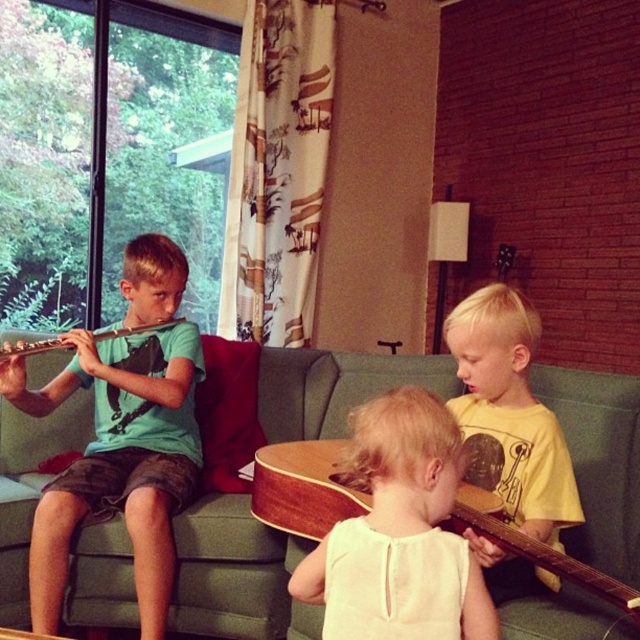
Question: Which is farther from the green matte t-shirt at left?

Choices:
 (A) green fabric couch at center
 (B) light blonde hair at center
 (C) wooden acoustic guitar at center

Answer: (B)

Question: Considering the relative positions of light blonde hair at center and wooden acoustic guitar at center in the image provided, where is light blonde hair at center located with respect to wooden acoustic guitar at center?

Choices:
 (A) above
 (B) below

Answer: (A)

Question: Is light blonde hair at center to the left of wooden acoustic guitar at center from the viewer's perspective?

Choices:
 (A) no
 (B) yes

Answer: (B)

Question: Is green matte t-shirt at left further to the viewer compared to wooden acoustic guitar at center?

Choices:
 (A) no
 (B) yes

Answer: (B)

Question: Which object is the farthest from the wooden acoustic guitar at center?

Choices:
 (A) light blonde hair at center
 (B) green matte t-shirt at left

Answer: (B)

Question: Estimate the real-world distances between objects in this image. Which object is closer to the green matte t-shirt at left?

Choices:
 (A) light blonde hair at center
 (B) wooden acoustic guitar at center

Answer: (B)